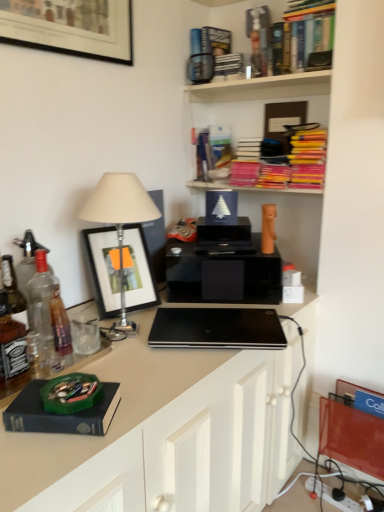
Where is `empty space that is ontop of wooden bookshelf at upper center, which ranks as the 2th shelf in top-to-bottom order (from a real-world perspective)`? empty space that is ontop of wooden bookshelf at upper center, which ranks as the 2th shelf in top-to-bottom order (from a real-world perspective) is located at coordinates pos(267,80).